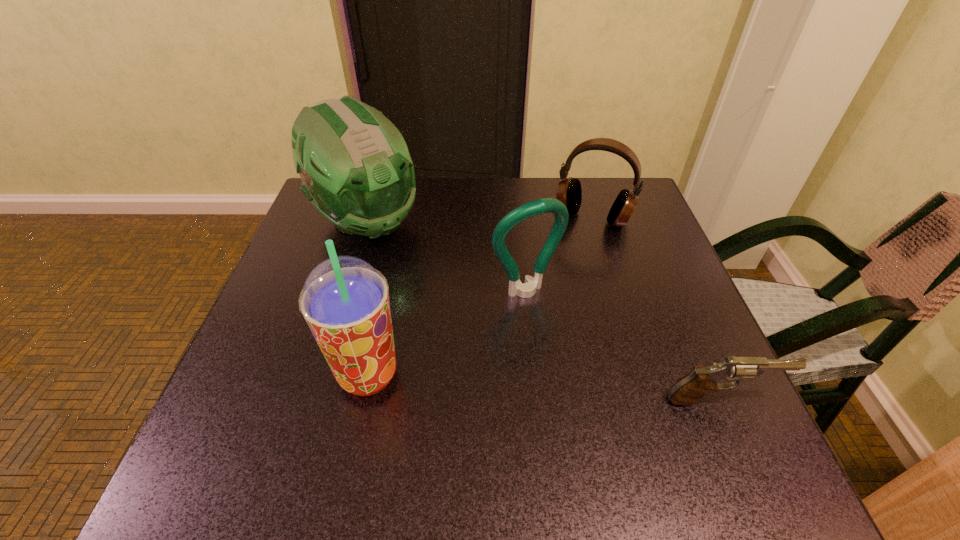
Where is `vacant point located between the smoothie and the shortest object`? vacant point located between the smoothie and the shortest object is located at coordinates (544, 387).

At what (x,y) coordinates should I click in order to perform the action: click on empty space that is in between the pistol and the smoothie. Please return your answer as a coordinate pair (x, y). This screenshot has width=960, height=540. Looking at the image, I should click on point(544,387).

Where is `object that ranks as the closest to the headset`? object that ranks as the closest to the headset is located at coordinates coord(546,205).

Locate an element on the screen. This screenshot has width=960, height=540. object that is the closest one to the smoothie is located at coordinates (546, 205).

You are a GUI agent. You are given a task and a screenshot of the screen. Output one action in this format:
    pyautogui.click(x=<x>, y=<y>)
    Task: Click on the free point that satisfies the following two spatial constraints: 1. on the front side of the shortest object; 2. at the barrel of the headset
    The image size is (960, 540).
    Given the screenshot: What is the action you would take?
    pyautogui.click(x=648, y=400)

Find the location of a particular element. This screenshot has width=960, height=540. free location that satisfies the following two spatial constraints: 1. on the front side of the pistol; 2. at the barrel of the third object from left to right is located at coordinates (536, 400).

The image size is (960, 540). What are the coordinates of `vacant space that satisfies the following two spatial constraints: 1. on the front side of the pistol; 2. at the barrel of the football helmet` in the screenshot? It's located at (312, 400).